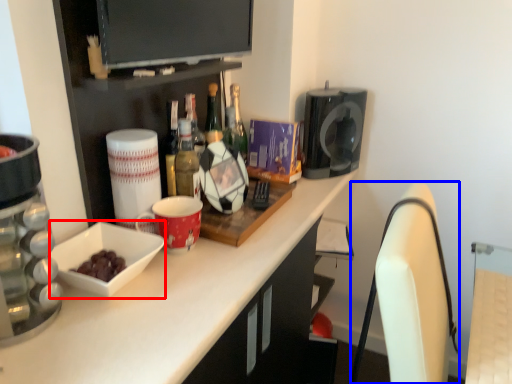
Question: Which of the following is the farthest to the observer, bowl (highlighted by a red box) or swivel chair (highlighted by a blue box)?

Choices:
 (A) bowl
 (B) swivel chair

Answer: (A)